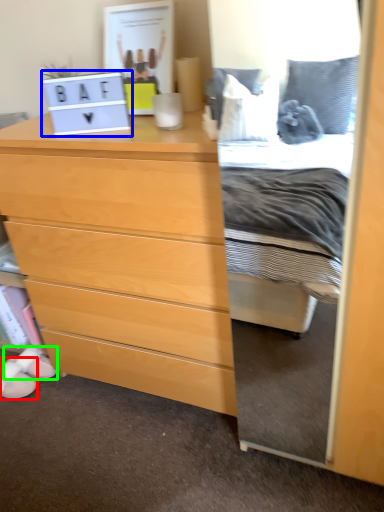
Question: Which object is positioned farthest from shoe (highlighted by a red box)? Select from laptop (highlighted by a blue box) and shoe (highlighted by a green box).

Choices:
 (A) laptop
 (B) shoe

Answer: (A)